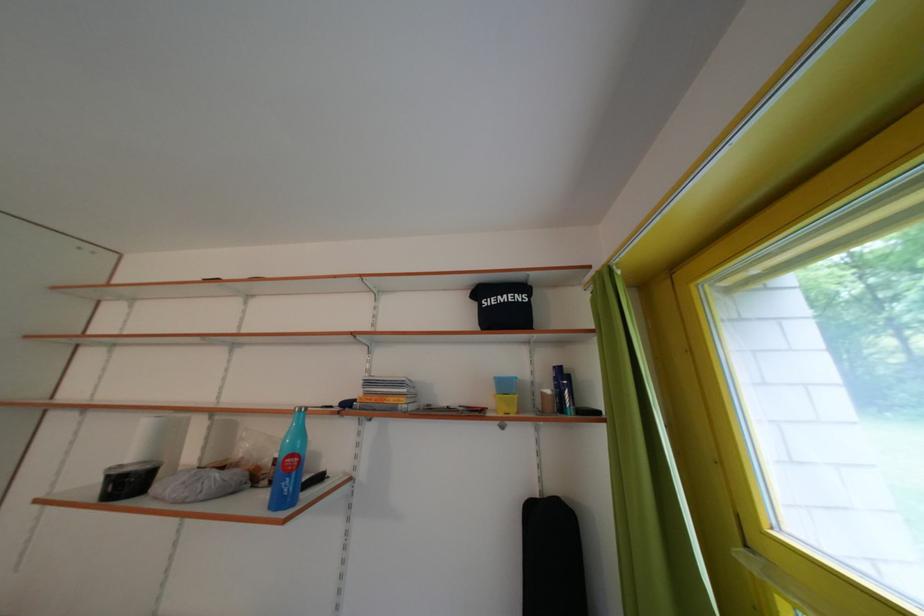
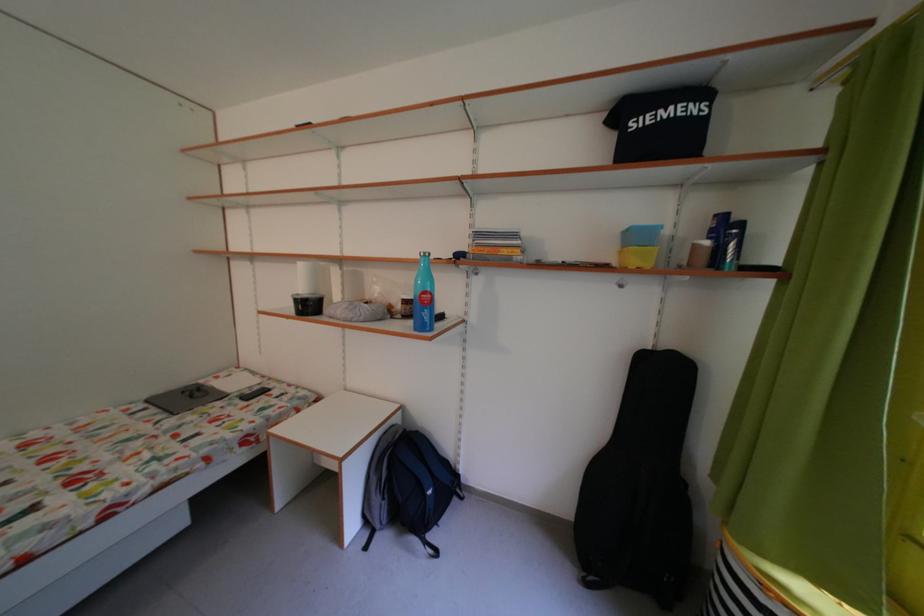
The point at (155,428) is marked in the first image. Where is the corresponding point in the second image?

(311, 270)